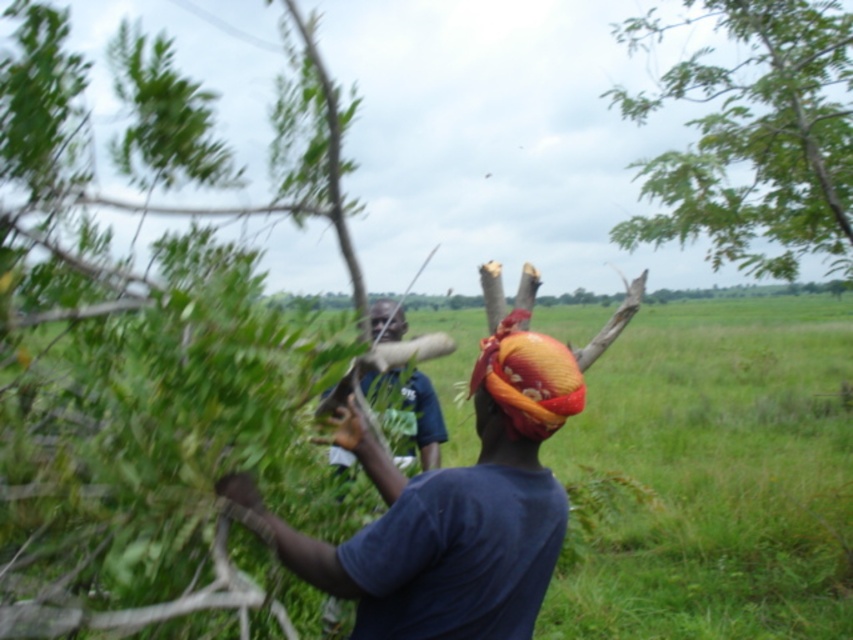
Measure the distance from green leafy tree at upper right to matte blue shirt at center.

green leafy tree at upper right and matte blue shirt at center are 8.30 meters apart from each other.

Can you confirm if green leafy tree at upper right is positioned to the right of matte blue shirt at center?

Correct, you'll find green leafy tree at upper right to the right of matte blue shirt at center.

Measure the distance between green leafy tree at upper right and camera.

The distance of green leafy tree at upper right from camera is 15.11 feet.

Identify the location of green leafy tree at upper right. This screenshot has height=640, width=853. (753, 138).

Can you confirm if orange fabric headscarf at center is positioned above matte blue shirt at center?

Actually, orange fabric headscarf at center is below matte blue shirt at center.

Between orange fabric headscarf at center and matte blue shirt at center, which one is positioned higher?

matte blue shirt at center is higher up.

Where is `orange fabric headscarf at center`? The image size is (853, 640). orange fabric headscarf at center is located at coordinates (527, 378).

Which of these two, blue fabric shirt at center or matte blue shirt at center, stands shorter?

Standing shorter between the two is matte blue shirt at center.

Find the location of a particular element. The image size is (853, 640). blue fabric shirt at center is located at coordinates (424, 419).

Identify the location of blue fabric shirt at center. The width and height of the screenshot is (853, 640). (424, 419).